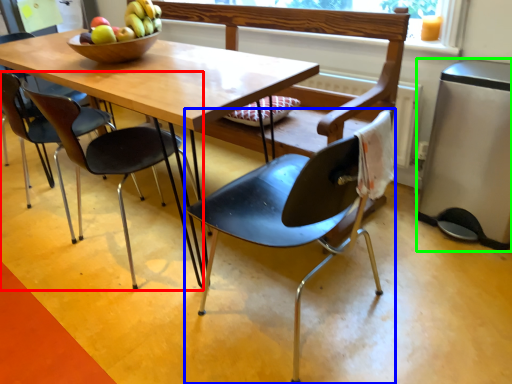
Question: Estimate the real-world distances between objects in this image. Which object is closer to chair (highlighted by a red box), chair (highlighted by a blue box) or appliance (highlighted by a green box)?

Choices:
 (A) chair
 (B) appliance

Answer: (A)